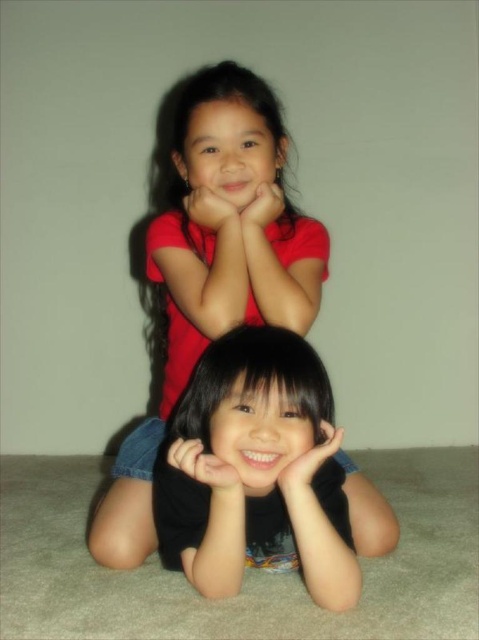
You are a photographer trying to capture a clear shot of both the matte red shirt at upper center and the black matte hand at lower center. Based on their positions, which object would appear closer to the camera in the photo?

The matte red shirt at upper center appears closer to the camera because it is taller than the black matte hand at lower center in the image.

You are a photographer trying to capture a candid shot of the children. You notice two hands in the frame. The smooth skin hand at lower center and the matte red hand at center. Which hand is closer to the camera?

The smooth skin hand at lower center is closer to the camera because it has a lesser height compared to the matte red hand at center, indicating it is positioned lower in the frame and thus nearer to the viewer.

What are the coordinates of the black matte hair at lower center?

The black matte hair at lower center is located at coordinates point [255,468].